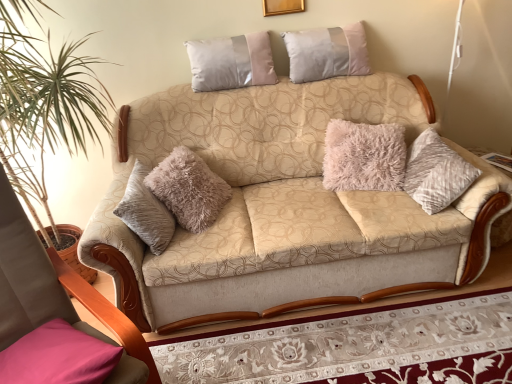
Question: Considering the relative positions of beige fabric couch at center and gold wooden picture frame at upper center in the image provided, is beige fabric couch at center in front of gold wooden picture frame at upper center?

Choices:
 (A) yes
 (B) no

Answer: (A)

Question: From a real-world perspective, is beige fabric couch at center below gold wooden picture frame at upper center?

Choices:
 (A) yes
 (B) no

Answer: (A)

Question: Is gold wooden picture frame at upper center a part of beige fabric couch at center?

Choices:
 (A) no
 (B) yes

Answer: (A)

Question: From the image's perspective, is beige fabric couch at center beneath gold wooden picture frame at upper center?

Choices:
 (A) yes
 (B) no

Answer: (A)

Question: Is beige fabric couch at center to the left of gold wooden picture frame at upper center from the viewer's perspective?

Choices:
 (A) yes
 (B) no

Answer: (B)

Question: Is beige fabric couch at center facing towards gold wooden picture frame at upper center?

Choices:
 (A) no
 (B) yes

Answer: (A)

Question: From the image's perspective, is pink fabric pillow at lower left, which ranks as the 3th pillow in top-to-bottom order, on top of beige fabric couch at center?

Choices:
 (A) no
 (B) yes

Answer: (A)

Question: Is pink fabric pillow at lower left, which ranks as the 3th pillow in top-to-bottom order, looking in the opposite direction of beige fabric couch at center?

Choices:
 (A) no
 (B) yes

Answer: (A)

Question: Does pink fabric pillow at lower left, which appears as the third pillow when viewed from the right, have a larger size compared to beige fabric couch at center?

Choices:
 (A) yes
 (B) no

Answer: (B)

Question: Is pink fabric pillow at lower left, which is the 3th pillow from back to front, to the left of beige fabric couch at center from the viewer's perspective?

Choices:
 (A) no
 (B) yes

Answer: (B)

Question: From the image's perspective, is pink fabric pillow at lower left, which appears as the third pillow when viewed from the right, located beneath beige fabric couch at center?

Choices:
 (A) yes
 (B) no

Answer: (A)

Question: Is beige fabric couch at center facing away from pink fabric pillow at lower left, arranged as the 1th pillow when ordered from the bottom?

Choices:
 (A) no
 (B) yes

Answer: (A)